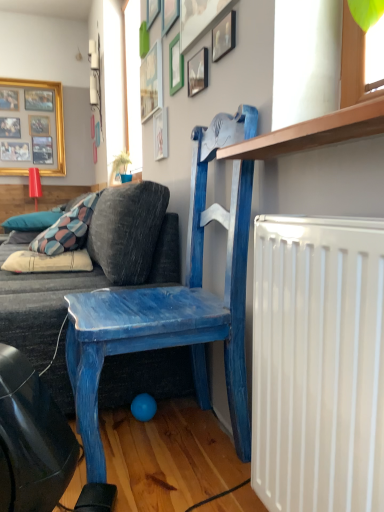
What do you see at coordinates (175, 66) in the screenshot? I see `matte white picture frame at upper center, acting as the 6th picture frame starting from the left` at bounding box center [175, 66].

Locate an element on the screen. The image size is (384, 512). wooden picture frame at upper center, marked as the sixth picture frame in a front-to-back arrangement is located at coordinates (160, 134).

This screenshot has width=384, height=512. What do you see at coordinates (169, 14) in the screenshot?
I see `green matte picture frame at upper center, which is the sixth picture frame from back to front` at bounding box center [169, 14].

What do you see at coordinates (151, 82) in the screenshot?
I see `wooden picture frame at upper center, the 2th picture frame in the left-to-right sequence` at bounding box center [151, 82].

This screenshot has height=512, width=384. Identify the location of dark gray fabric couch at left. (94, 267).

From the image's perspective, is green matte picture frame at upper center, positioned as the 4th picture frame in right-to-left order, on top of matte white picture frame at upper center, acting as the 4th picture frame starting from the front?

Correct, green matte picture frame at upper center, positioned as the 4th picture frame in right-to-left order, appears higher than matte white picture frame at upper center, acting as the 4th picture frame starting from the front, in the image.

Is green matte picture frame at upper center, which is the third picture frame in front-to-back order, completely or partially outside of matte white picture frame at upper center, which ranks as the third picture frame in right-to-left order?

Absolutely, green matte picture frame at upper center, which is the third picture frame in front-to-back order, is external to matte white picture frame at upper center, which ranks as the third picture frame in right-to-left order.

In the image, is green matte picture frame at upper center, which is the third picture frame in front-to-back order, positioned in front of or behind matte white picture frame at upper center, which ranks as the third picture frame in right-to-left order?

green matte picture frame at upper center, which is the third picture frame in front-to-back order, is in front of matte white picture frame at upper center, which ranks as the third picture frame in right-to-left order.

I want to click on the 1st picture frame counting from the right side of the green matte picture frame at upper center, positioned as the 4th picture frame in right-to-left order, so click(x=175, y=66).

Is matte white picture frame at upper center, acting as the 4th picture frame starting from the front, taller than wooden picture frame at upper center, placed as the 4th picture frame when sorted from back to front?

Incorrect, the height of matte white picture frame at upper center, acting as the 4th picture frame starting from the front, is not larger of that of wooden picture frame at upper center, placed as the 4th picture frame when sorted from back to front.

Choose the correct answer: Is matte white picture frame at upper center, acting as the 4th picture frame starting from the front, inside wooden picture frame at upper center, the 6th picture frame positioned from the right, or outside it?

matte white picture frame at upper center, acting as the 4th picture frame starting from the front, is not inside wooden picture frame at upper center, the 6th picture frame positioned from the right, it's outside.

Which object is further away from the camera taking this photo, matte white picture frame at upper center, which ranks as the third picture frame in right-to-left order, or wooden picture frame at upper center, which appears as the third picture frame when viewed from the left?

wooden picture frame at upper center, which appears as the third picture frame when viewed from the left, is further from the camera.

Starting from the matte white picture frame at upper center, acting as the 6th picture frame starting from the left, which picture frame is the 3rd one to the left? Please provide its 2D coordinates.

[(152, 11)]

In the scene shown: Between wooden picture frame at upper center, positioned as the 1th picture frame in front-to-back order, and wooden picture frame at upper center, the 2th picture frame in the left-to-right sequence, which one has larger width?

Wider between the two is wooden picture frame at upper center, the 2th picture frame in the left-to-right sequence.

At what (x,y) coordinates should I click in order to perform the action: click on the 2nd picture frame above the wooden picture frame at upper center, acting as the eighth picture frame starting from the back (from the image's perspective). Please return your answer as a coordinate pair (x, y). Looking at the image, I should click on (151, 82).

From the picture: Which is more to the left, wooden picture frame at upper center, which is the first picture frame from right to left, or wooden picture frame at upper center, the 2th picture frame in the left-to-right sequence?

wooden picture frame at upper center, the 2th picture frame in the left-to-right sequence.

Is wooden picture frame at upper center, positioned as the 1th picture frame in front-to-back order, taller than wooden picture frame at upper center, acting as the 7th picture frame starting from the front?

No.

In the scene shown: Between gold metallic picture frame at upper left, the 8th picture frame from the front, and patterned fabric pillow at lower left, which appears as the first pillow when viewed from the left, which one has smaller size?

patterned fabric pillow at lower left, which appears as the first pillow when viewed from the left, is smaller.

Considering the positions of objects gold metallic picture frame at upper left, which ranks as the 1th picture frame in left-to-right order, and patterned fabric pillow at lower left, acting as the second pillow starting from the bottom, in the image provided, who is more to the left, gold metallic picture frame at upper left, which ranks as the 1th picture frame in left-to-right order, or patterned fabric pillow at lower left, acting as the second pillow starting from the bottom,?

gold metallic picture frame at upper left, which ranks as the 1th picture frame in left-to-right order.

Which object is wider, gold metallic picture frame at upper left, the 8th picture frame from the front, or patterned fabric pillow at lower left, the first pillow in the top-to-bottom sequence?

With larger width is patterned fabric pillow at lower left, the first pillow in the top-to-bottom sequence.

Who is taller, gold metallic picture frame at upper left, the 8th picture frame from the front, or patterned fabric pillow at lower left, acting as the 2th pillow starting from the front?

With more height is gold metallic picture frame at upper left, the 8th picture frame from the front.

Is blue painted wood chair at upper center in front of or behind wooden picture frame at upper center, acting as the eighth picture frame starting from the back, in the image?

Clearly, blue painted wood chair at upper center is in front of wooden picture frame at upper center, acting as the eighth picture frame starting from the back.

Is blue painted wood chair at upper center placed right next to wooden picture frame at upper center, acting as the eighth picture frame starting from the back?

blue painted wood chair at upper center is not next to wooden picture frame at upper center, acting as the eighth picture frame starting from the back, and they're not touching.

What's the angular difference between blue painted wood chair at upper center and wooden picture frame at upper center, which is the first picture frame from right to left,'s facing directions?

There is a 1.17-degree angle between the facing directions of blue painted wood chair at upper center and wooden picture frame at upper center, which is the first picture frame from right to left.

Looking at this image, which object is wider, blue painted wood chair at upper center or wooden picture frame at upper center, the eighth picture frame when ordered from left to right?

With larger width is blue painted wood chair at upper center.

Which object is wider, dark gray fabric couch at left or green matte picture frame at upper center, which is the sixth picture frame from back to front?

With larger width is dark gray fabric couch at left.

Is there a large distance between dark gray fabric couch at left and green matte picture frame at upper center, which is the third picture frame in front-to-back order?

Yes.

From a real-world perspective, is dark gray fabric couch at left located beneath green matte picture frame at upper center, the 5th picture frame in the left-to-right sequence?

Yes, from a real-world perspective, dark gray fabric couch at left is below green matte picture frame at upper center, the 5th picture frame in the left-to-right sequence.

Considering the relative positions of dark gray fabric couch at left and green matte picture frame at upper center, the 5th picture frame in the left-to-right sequence, in the image provided, is dark gray fabric couch at left to the right of green matte picture frame at upper center, the 5th picture frame in the left-to-right sequence, from the viewer's perspective?

Incorrect, dark gray fabric couch at left is not on the right side of green matte picture frame at upper center, the 5th picture frame in the left-to-right sequence.

Find the location of a particular element. studio couch below the white cotton pillow at lower left, which ranks as the 1th pillow in front-to-back order (from a real-world perspective) is located at coordinates (94, 267).

From the image's perspective, is white cotton pillow at lower left, acting as the 1th pillow starting from the right, above or below dark gray fabric couch at left?

white cotton pillow at lower left, acting as the 1th pillow starting from the right, is situated higher than dark gray fabric couch at left in the image.

Which of these two, white cotton pillow at lower left, acting as the 1th pillow starting from the right, or dark gray fabric couch at left, is thinner?

white cotton pillow at lower left, acting as the 1th pillow starting from the right.

Looking at this image, is dark gray fabric couch at left inside white cotton pillow at lower left, marked as the 2th pillow in a back-to-front arrangement?

No, dark gray fabric couch at left is not inside white cotton pillow at lower left, marked as the 2th pillow in a back-to-front arrangement.

From a real-world perspective, starting from the green matte picture frame at upper center, the 5th picture frame in the left-to-right sequence, which picture frame is the 3rd one below it? Please provide its 2D coordinates.

[(175, 66)]

From the image's perspective, count 3rd picture frames upward from the matte white picture frame at upper center, acting as the 4th picture frame starting from the front, and point to it. Please provide its 2D coordinates.

[(152, 11)]

When comparing their distances from wooden picture frame at upper center, the 7th picture frame when ordered from left to right, does matte white picture frame at upper center, acting as the 4th picture frame starting from the front, or patterned fabric pillow at lower left, acting as the 1th pillow starting from the back, seem closer?

matte white picture frame at upper center, acting as the 4th picture frame starting from the front, is positioned closer to the anchor wooden picture frame at upper center, the 7th picture frame when ordered from left to right.

Looking at the image, which one is located further to dark gray fabric couch at left, wooden picture frame at upper center, the 2th picture frame viewed from the right, or wooden picture frame at upper center, the 6th picture frame positioned from the right?

Based on the image, wooden picture frame at upper center, the 6th picture frame positioned from the right, appears to be further to dark gray fabric couch at left.

Based on their spatial positions, is gold metallic picture frame at upper left, the 8th picture frame from the front, or white cotton pillow at lower left, marked as the 2th pillow in a back-to-front arrangement, further from wooden picture frame at upper center, placed as the 4th picture frame when sorted from back to front?

The object further to wooden picture frame at upper center, placed as the 4th picture frame when sorted from back to front, is gold metallic picture frame at upper left, the 8th picture frame from the front.

Which object lies further to the anchor point patterned fabric pillow at lower left, the first pillow in the top-to-bottom sequence, blue painted wood chair at upper center or wooden picture frame at upper center, acting as the 7th picture frame starting from the front?

Based on the image, blue painted wood chair at upper center appears to be further to patterned fabric pillow at lower left, the first pillow in the top-to-bottom sequence.

In the scene shown: Considering their positions, is blue painted wood chair at upper center positioned further to wooden picture frame at upper center, arranged as the fourth picture frame when viewed from the left, than matte white picture frame at upper center, the fifth picture frame from the back?

blue painted wood chair at upper center is further to wooden picture frame at upper center, arranged as the fourth picture frame when viewed from the left.

In the scene shown: Estimate the real-world distances between objects in this image. Which object is closer to wooden picture frame at upper center, the eighth picture frame when ordered from left to right, wooden picture frame at upper center, the second picture frame from the back, or wooden picture frame at upper center, marked as the sixth picture frame in a front-to-back arrangement?

wooden picture frame at upper center, marked as the sixth picture frame in a front-to-back arrangement, lies closer to wooden picture frame at upper center, the eighth picture frame when ordered from left to right, than the other object.

When comparing their distances from wooden picture frame at upper center, acting as the eighth picture frame starting from the back, does dark gray fabric couch at left or white cotton pillow at lower left, the 2th pillow from the top, seem closer?

dark gray fabric couch at left.

Estimate the real-world distances between objects in this image. Which object is further from wooden picture frame at upper center, which appears as the 5th picture frame when viewed from the right, white cotton pillow at lower left, the 2th pillow from the top, or wooden picture frame at upper center, which appears as the third picture frame when viewed from the left?

Based on the image, white cotton pillow at lower left, the 2th pillow from the top, appears to be further to wooden picture frame at upper center, which appears as the 5th picture frame when viewed from the right.

The width and height of the screenshot is (384, 512). Identify the location of picture frame between wooden picture frame at upper center, the 5th picture frame when ordered from front to back, and wooden picture frame at upper center, the 2th picture frame in the left-to-right sequence, from top to bottom. (169, 14).

You are a GUI agent. You are given a task and a screenshot of the screen. Output one action in this format:
    pyautogui.click(x=<x>, y=<y>)
    Task: Click on the picture frame located between wooden picture frame at upper center, arranged as the fourth picture frame when viewed from the left, and gold metallic picture frame at upper left, which is the first picture frame in back-to-front order, in the depth direction
    The height and width of the screenshot is (512, 384).
    Given the screenshot: What is the action you would take?
    pyautogui.click(x=151, y=82)

This screenshot has height=512, width=384. I want to click on pillow positioned between dark gray fabric couch at left and patterned fabric pillow at lower left, acting as the 2th pillow starting from the front, from near to far, so click(x=47, y=262).

Locate an element on the screen. This screenshot has height=512, width=384. studio couch positioned between blue painted wood chair at upper center and gold metallic picture frame at upper left, which ranks as the 1th picture frame in left-to-right order, from near to far is located at coordinates (94, 267).